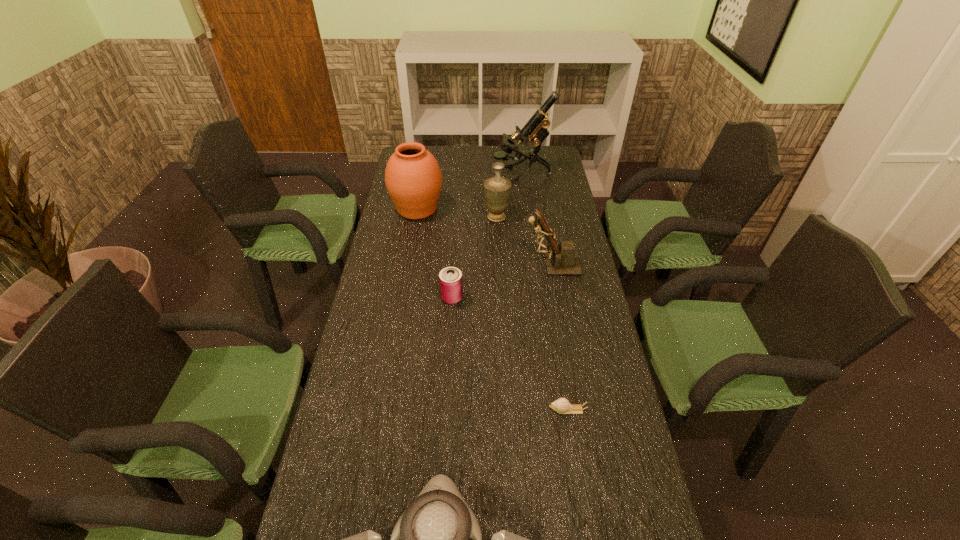
Locate an element on the screen. This screenshot has height=540, width=960. microscope is located at coordinates (536, 128).

Locate an element on the screen. Image resolution: width=960 pixels, height=540 pixels. the tallest object is located at coordinates (536, 128).

You are a GUI agent. You are given a task and a screenshot of the screen. Output one action in this format:
    pyautogui.click(x=<x>, y=<y>)
    Task: Click on the left urn
    The height and width of the screenshot is (540, 960).
    Given the screenshot: What is the action you would take?
    pyautogui.click(x=413, y=178)

Identify the location of the fourth farthest object. pos(563,259).

Identify the location of the shorter urn. This screenshot has height=540, width=960. (497, 189).

The width and height of the screenshot is (960, 540). What are the coordinates of `the third nearest object` in the screenshot? It's located at (450, 278).

Locate an element on the screen. This screenshot has width=960, height=540. escargot is located at coordinates (562, 406).

Find the location of a particular element. This screenshot has height=540, width=960. the shortest object is located at coordinates (562, 406).

At what (x,y) coordinates should I click in order to perform the action: click on vacant space located through the eyepiece of the microscope. Please return your answer as a coordinate pair (x, y). The height and width of the screenshot is (540, 960). Looking at the image, I should click on (450, 174).

In order to click on vacant area located 0.290m through the eyepiece of the microscope in this screenshot , I will do `click(427, 174)`.